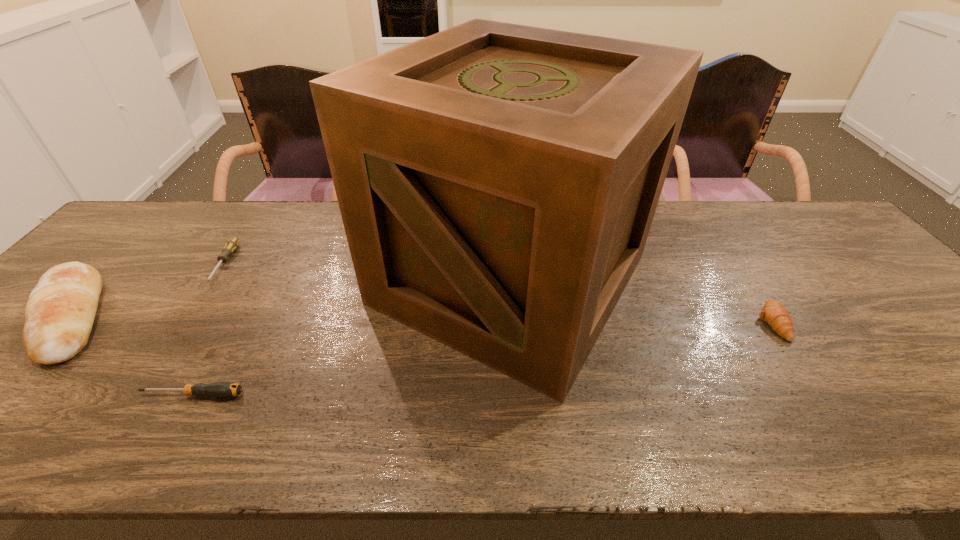
The image size is (960, 540). Identify the location of vacant area that lies between the nearer screwdriver and the farther screwdriver. (208, 329).

Identify which object is located as the second nearest to the nearer screwdriver. Please provide its 2D coordinates. Your answer should be formatted as a tuple, i.e. [(x, y)], where the tuple contains the x and y coordinates of a point satisfying the conditions above.

[(497, 182)]

Identify the location of object identified as the third closest to the farther screwdriver. The width and height of the screenshot is (960, 540). (497, 182).

Locate an element on the screen. vacant area in the image that satisfies the following two spatial constraints: 1. on the back side of the nearer screwdriver; 2. on the left side of the rightmost object is located at coordinates (233, 322).

The width and height of the screenshot is (960, 540). What are the coordinates of `blank space that satisfies the following two spatial constraints: 1. at the tip of the rightmost object; 2. on the left side of the farther screwdriver` in the screenshot? It's located at (186, 322).